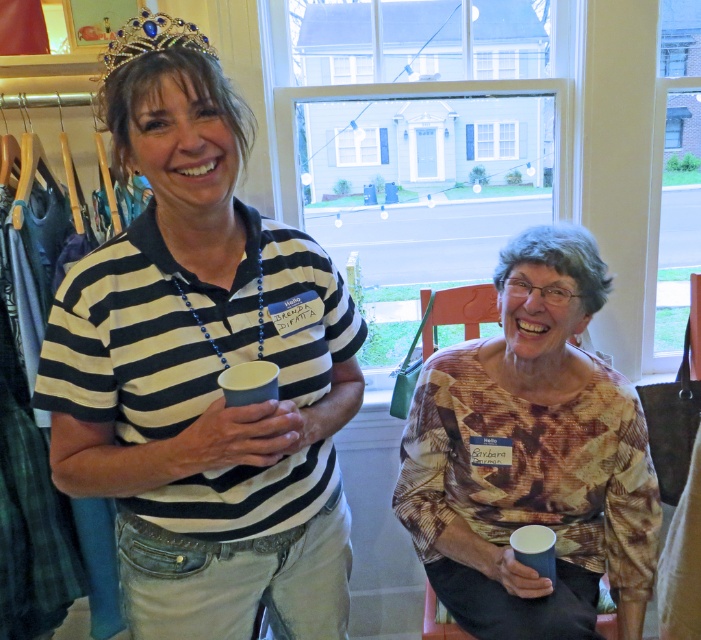
Question: Based on their relative distances, which object is nearer to the printed fabric blouse at center?

Choices:
 (A) gold beaded crown at upper center
 (B) striped cotton shirt at center

Answer: (B)

Question: Does striped cotton shirt at center appear under printed fabric blouse at center?

Choices:
 (A) no
 (B) yes

Answer: (A)

Question: Can you confirm if striped cotton shirt at center is thinner than gold beaded crown at upper center?

Choices:
 (A) no
 (B) yes

Answer: (A)

Question: Is striped cotton shirt at center to the right of printed fabric blouse at center from the viewer's perspective?

Choices:
 (A) yes
 (B) no

Answer: (B)

Question: Which point is closer to the camera taking this photo?

Choices:
 (A) (573, 250)
 (B) (252, 516)
 (C) (139, 45)

Answer: (C)

Question: Which point is farther to the camera?

Choices:
 (A) striped cotton shirt at center
 (B) printed fabric blouse at center

Answer: (B)